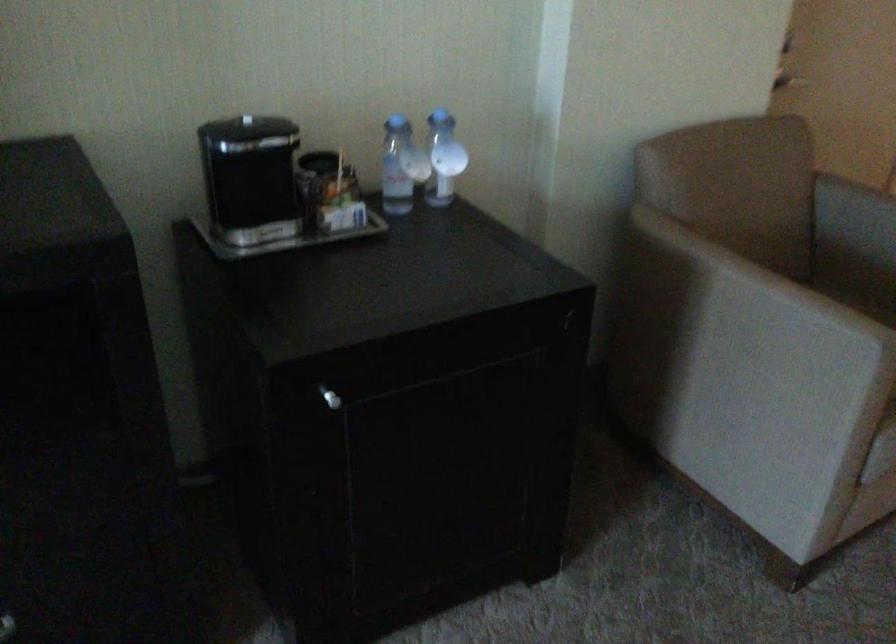
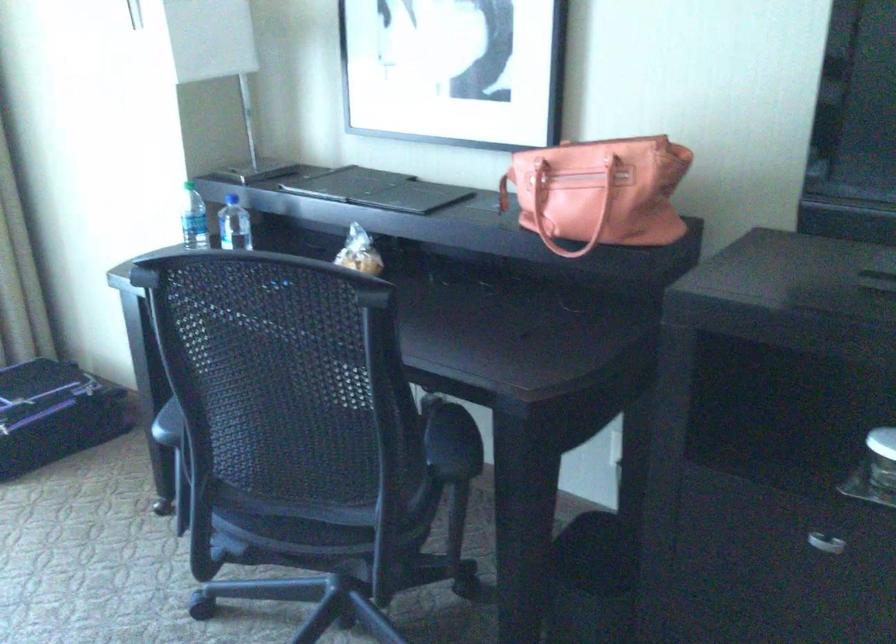
Question: How did the camera likely rotate?

Choices:
 (A) Left
 (B) Right
 (C) Up
 (D) Down

Answer: (A)